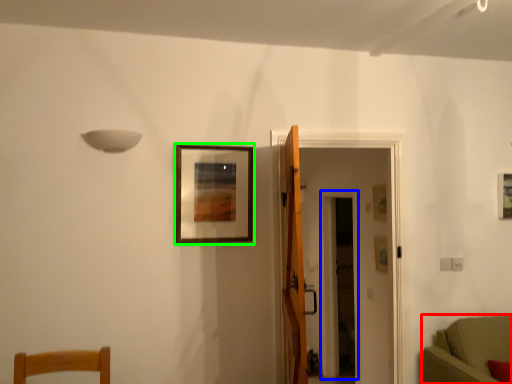
Question: Which object is the closest to the furniture (highlighted by a red box)? Choose among these: glass door (highlighted by a blue box) or picture frame (highlighted by a green box).

Choices:
 (A) glass door
 (B) picture frame

Answer: (B)